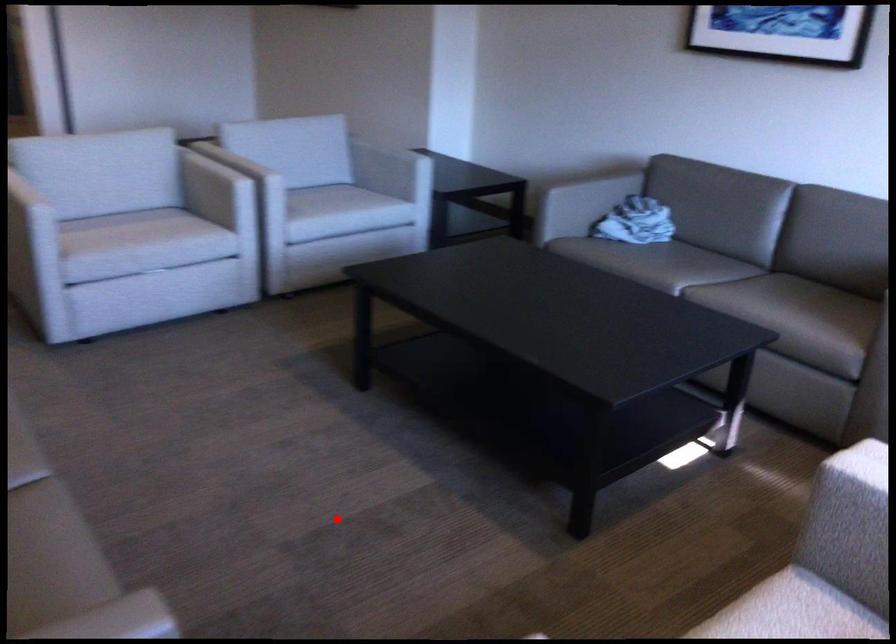
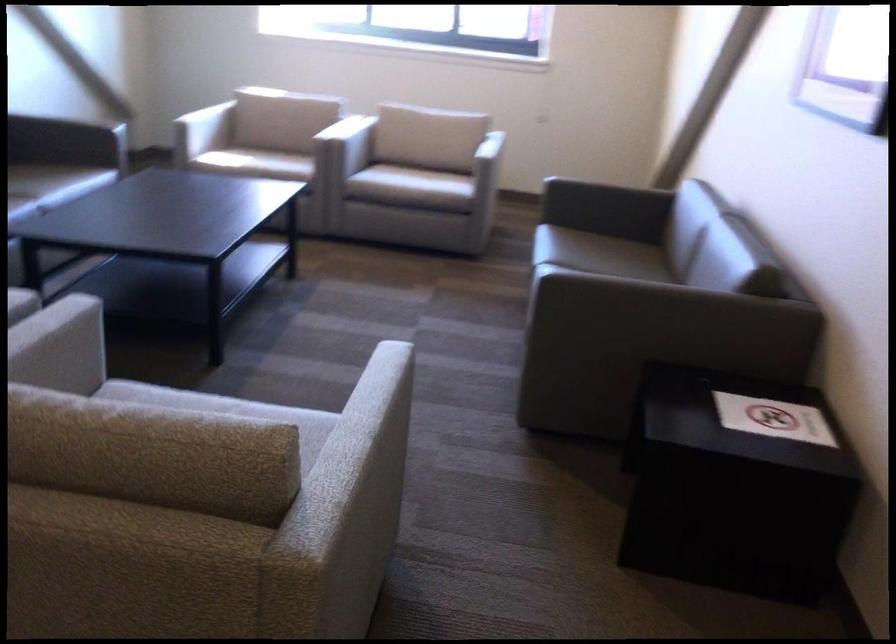
Locate, in the second image, the point that corresponds to the highlighted location in the first image.

(352, 330)